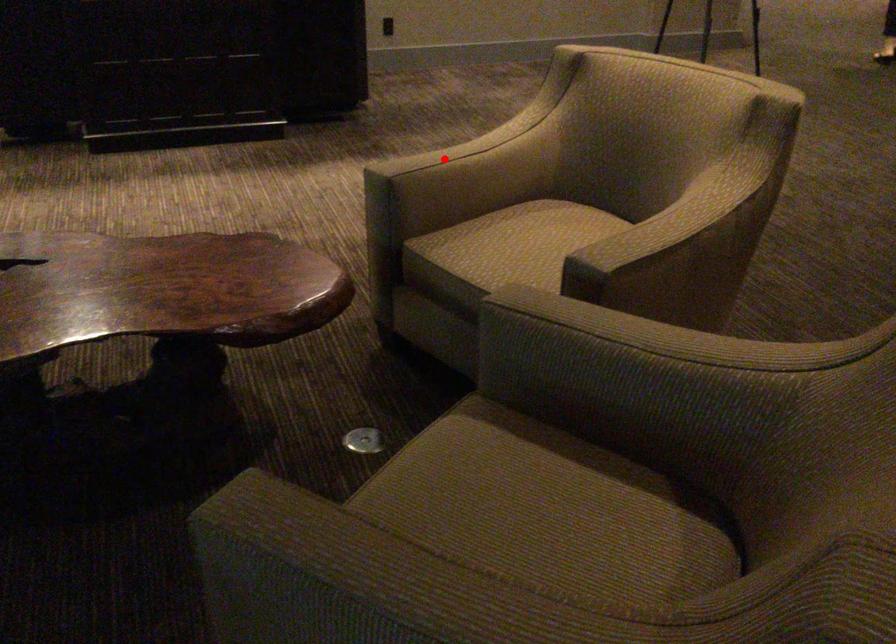
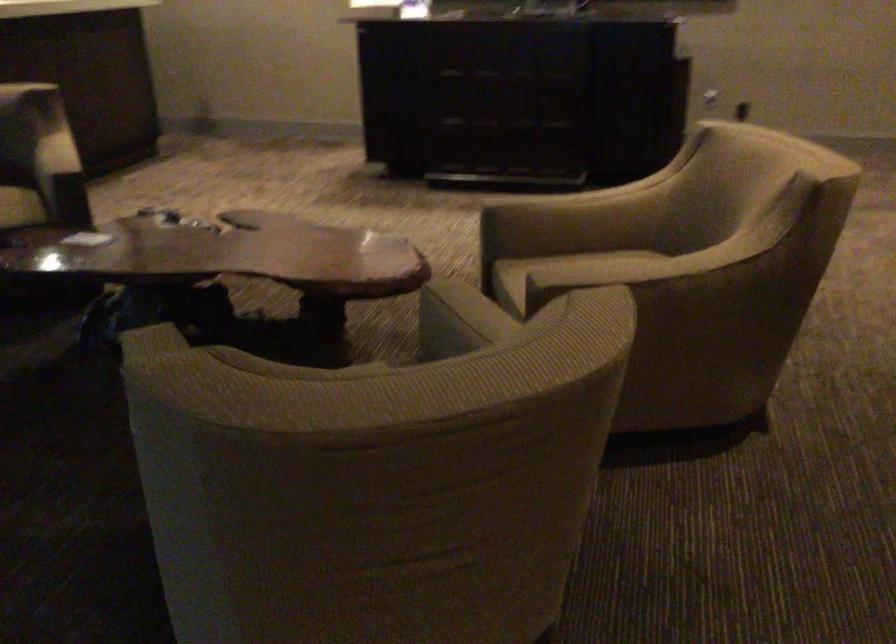
Where in the second image is the point corresponding to the highlighted location from the first image?

(547, 200)